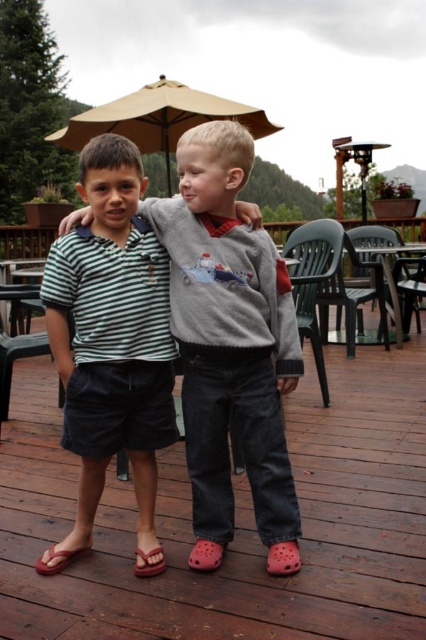
You are setting up a picnic and need to place a blanket between the green plastic chair at center and the black plastic chair at lower left. Which chair should you place the blanket closer to based on their positions?

The green plastic chair at center is located above the black plastic chair at lower left, so you should place the blanket closer to the black plastic chair at lower left since it is lower down.

You are a photographer trying to capture a photo of the two boys on the wooden deck. You notice two specific points marked on the image at coordinates point (x=324, y=221) and point (x=325, y=371). If you want to ensure both points are in focus, which point should you focus on first to maintain clarity for both?

You should focus on point (x=324, y=221) first because it is closer to the camera than point (x=325, y=371). By focusing on the closer point, the farther point will also be within the depth of field, ensuring both are in focus.